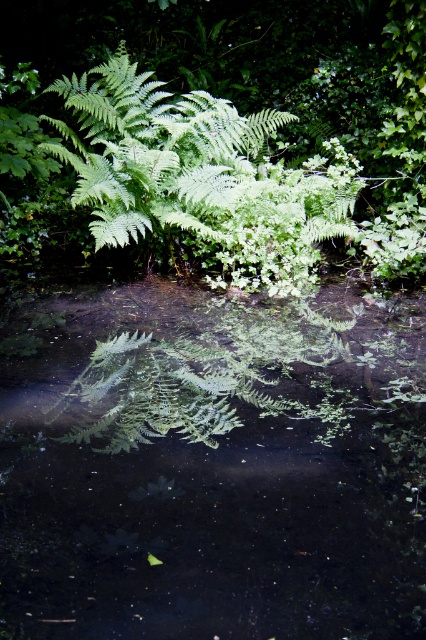
You are standing at the edge of the water in the scene. If you want to reach the green leafy water at center, which direction should you move in? Please provide your answer in terms of coordinates relative to your current position. Assume your current position is at the origin point.

The green leafy water at center is located at coordinates point (x=212, y=465), so you should move towards the northeast direction to reach it.

You are standing at the edge of the water and looking towards the fern. Which object is closer to you, the green leafy water at center or the green leafy fern at upper center?

The green leafy water at center is closer to you because it is in front of the green leafy fern at upper center.

You are standing at the edge of the water and want to place a small floating decoration. The decoration needs to be placed between the green leafy water at center and the green leafy fern at upper center. Is this possible?

The green leafy water at center is below the green leafy fern at upper center, so placing the decoration between them would require positioning it in the water beneath the fern.